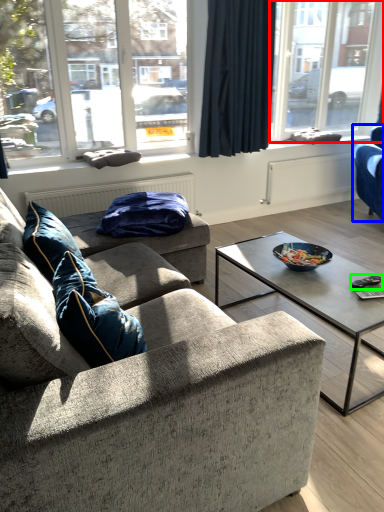
Question: Estimate the real-world distances between objects in this image. Which object is farther from window (highlighted by a red box), studio couch (highlighted by a blue box) or remote (highlighted by a green box)?

Choices:
 (A) studio couch
 (B) remote

Answer: (B)